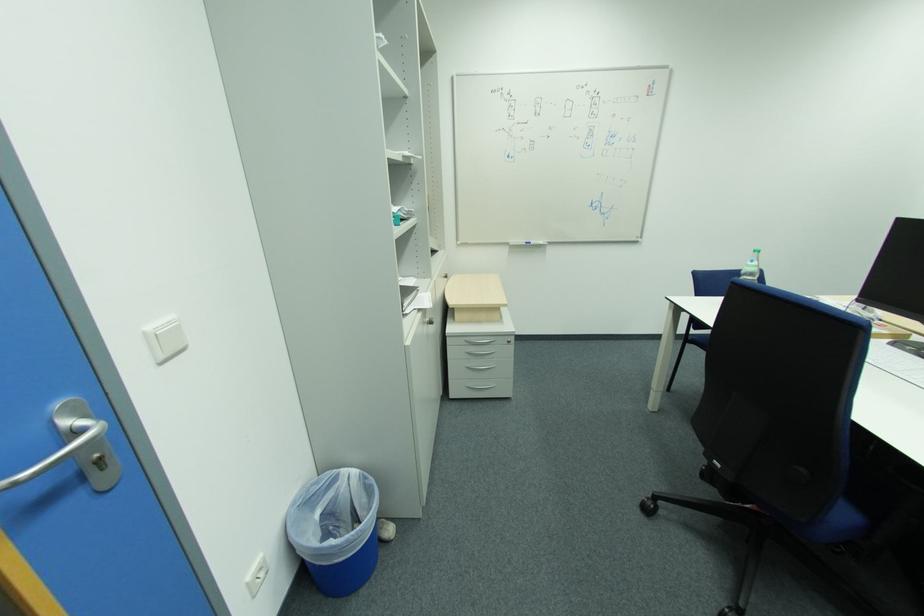
What do you see at coordinates (165, 339) in the screenshot? The height and width of the screenshot is (616, 924). I see `the white light switch` at bounding box center [165, 339].